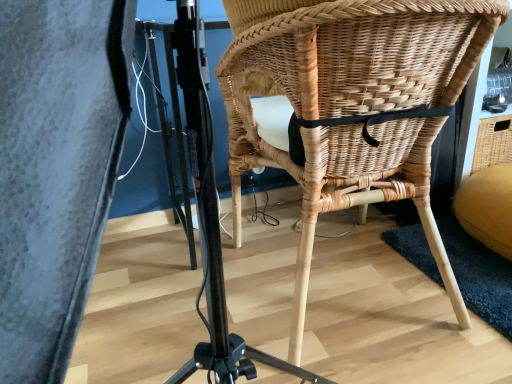
The height and width of the screenshot is (384, 512). I want to click on natural wicker chair at center, so click(x=348, y=106).

Describe the element at coordinates (348, 106) in the screenshot. The height and width of the screenshot is (384, 512). I see `natural wicker chair at center` at that location.

Consider the image. What is the approximate width of natural wicker chair at center?

The width of natural wicker chair at center is 64.78 centimeters.

You are a GUI agent. You are given a task and a screenshot of the screen. Output one action in this format:
    pyautogui.click(x=<x>, y=<y>)
    Task: Click on the natural wicker chair at center
    
    Given the screenshot: What is the action you would take?
    pyautogui.click(x=348, y=106)